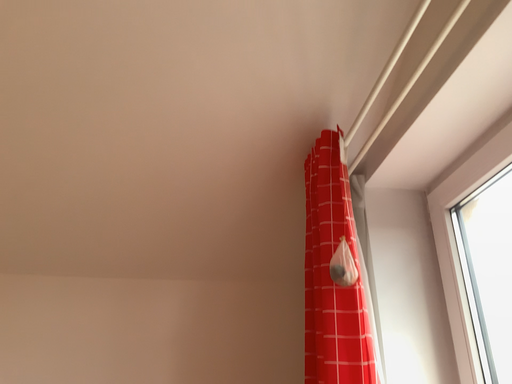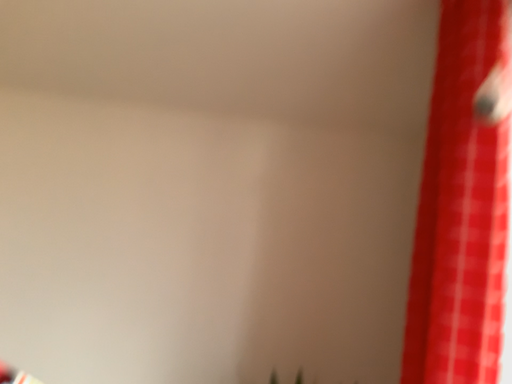
Question: How did the camera likely rotate when shooting the video?

Choices:
 (A) rotated left
 (B) rotated right

Answer: (A)